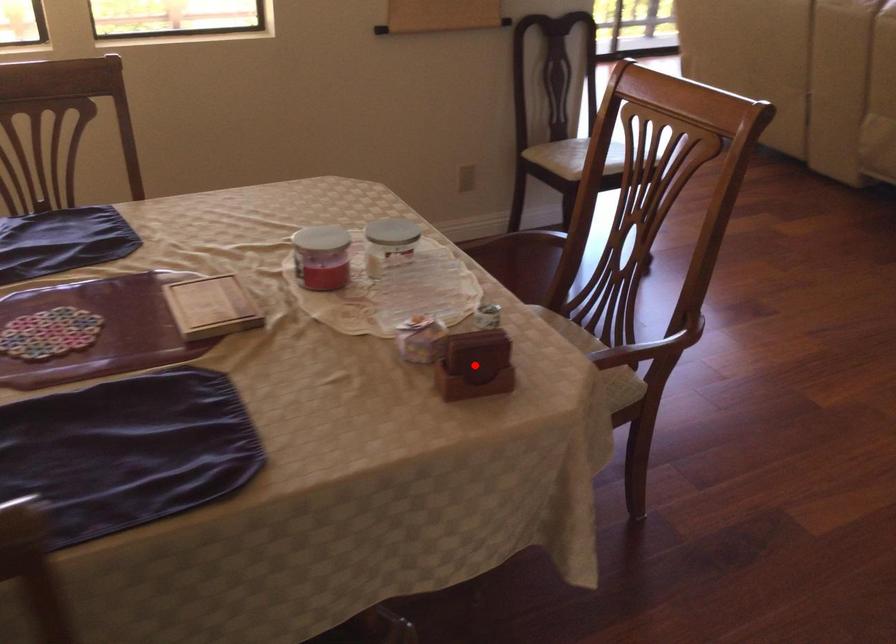
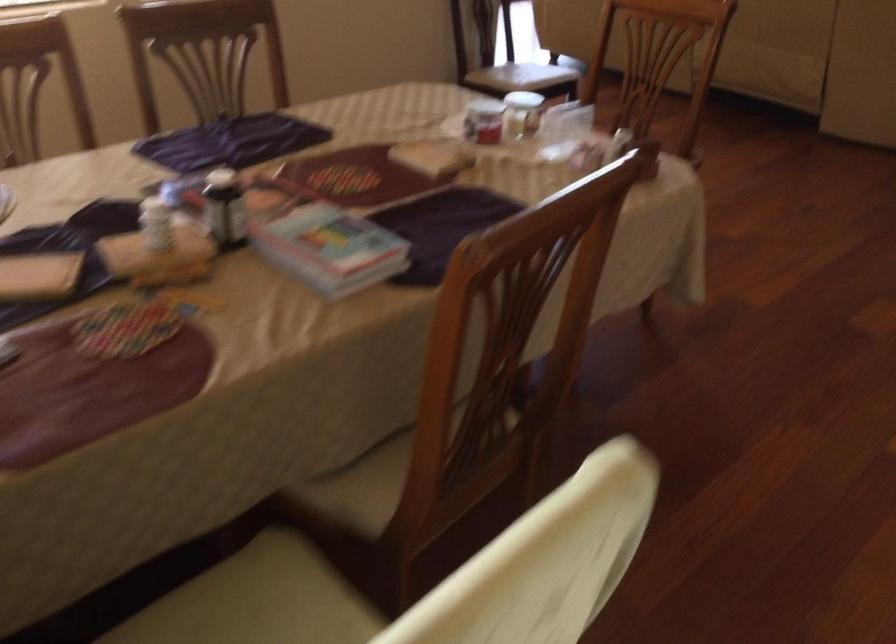
Question: I am providing you with two images of the same scene from different viewpoints. A red point is marked on the first image. Is the red point's position out of view in image 2?

Choices:
 (A) Yes
 (B) No

Answer: (A)